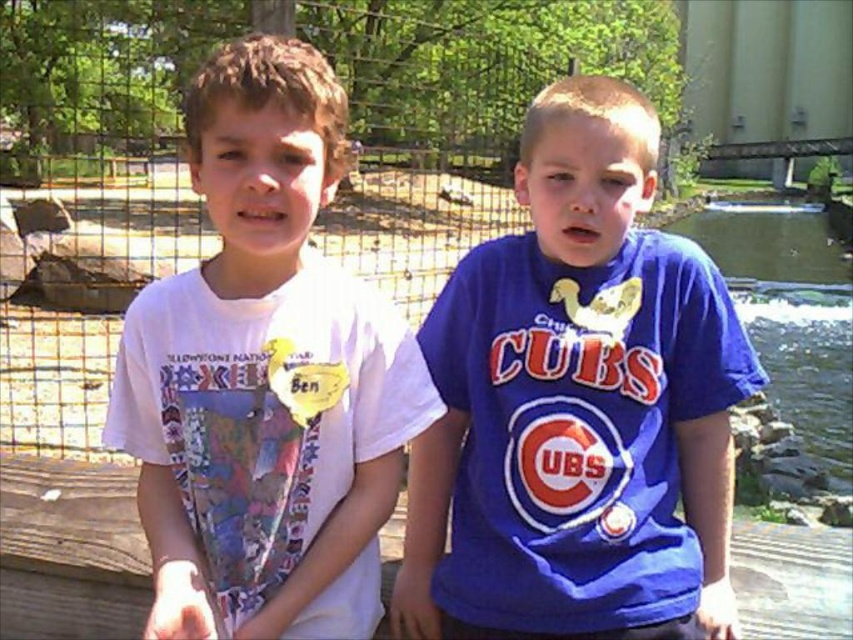
Who is positioned more to the left, blue fabric shirt at center or clear water at creek right?

From the viewer's perspective, blue fabric shirt at center appears more on the left side.

Can you confirm if blue fabric shirt at center is smaller than clear water at creek right?

Indeed, blue fabric shirt at center has a smaller size compared to clear water at creek right.

Does point (613, 429) come behind point (836, 282)?

No, it is not.

This screenshot has height=640, width=853. What are the coordinates of `blue fabric shirt at center` in the screenshot? It's located at (577, 403).

Which is more to the left, blue fabric shirt at center or metal mesh fence at center?

metal mesh fence at center

Is blue fabric shirt at center thinner than metal mesh fence at center?

Indeed, blue fabric shirt at center has a lesser width compared to metal mesh fence at center.

In the scene shown: Who is more distant from viewer, (512, 419) or (57, 451)?

The point (57, 451) is more distant.

Identify the location of blue fabric shirt at center. (577, 403).

Locate an element on the screen. white printed t-shirt at center is located at coordinates (265, 376).

Who is more distant from viewer, (230, 83) or (367, 48)?

Positioned behind is point (367, 48).

Where is `white printed t-shirt at center`? The height and width of the screenshot is (640, 853). white printed t-shirt at center is located at coordinates (265, 376).